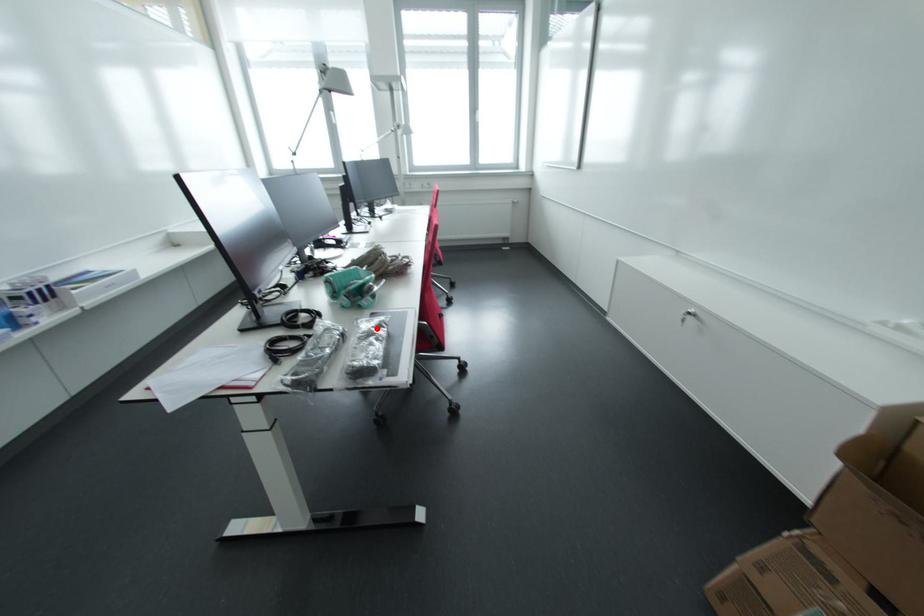
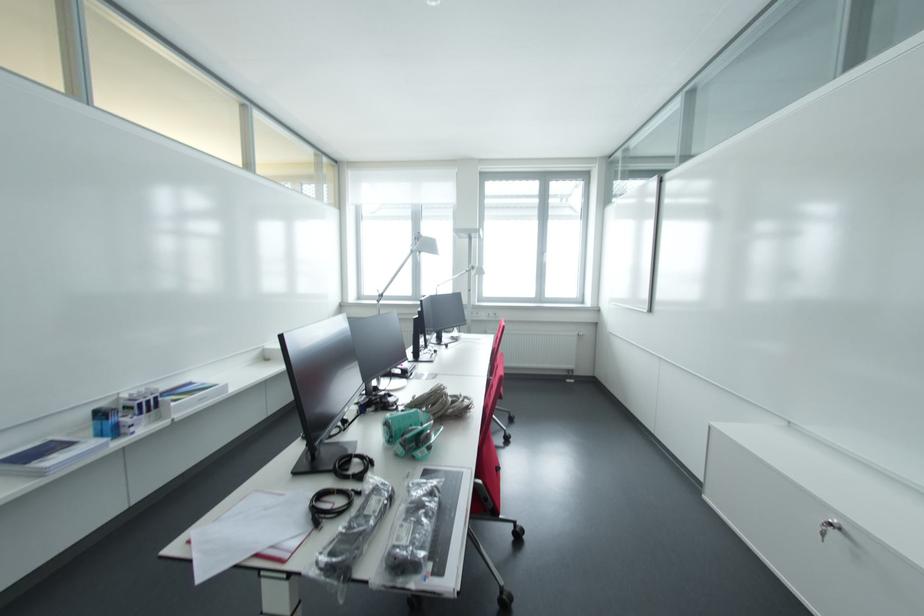
Where in the second image is the point corresponding to the highlighted location from the first image?

(428, 496)